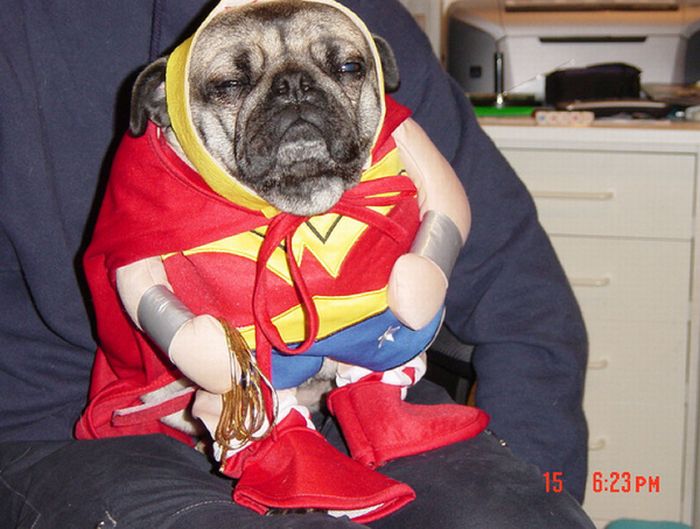
Find the location of a particular element. cabinet is located at coordinates (652, 299).